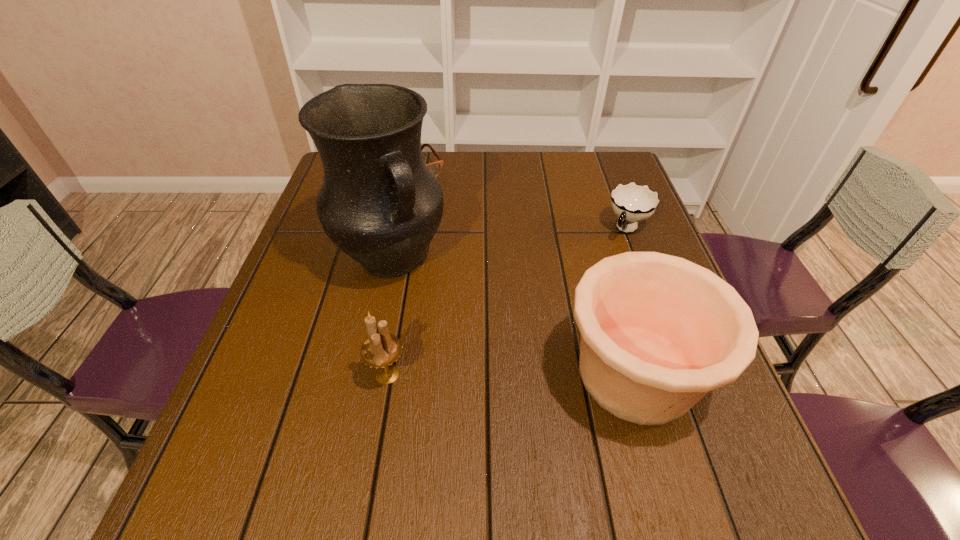
In the image, there is a desktop. What are the coordinates of `vacant space at the far right corner` in the screenshot? It's located at (582, 175).

Identify the location of vacant region between the cup and the shortest object. (519, 199).

At what (x,y) coordinates should I click in order to perform the action: click on vacant point located between the pottery and the pitcher. Please return your answer as a coordinate pair (x, y). Image resolution: width=960 pixels, height=540 pixels. Looking at the image, I should click on pyautogui.click(x=514, y=315).

You are a GUI agent. You are given a task and a screenshot of the screen. Output one action in this format:
    pyautogui.click(x=<x>, y=<y>)
    Task: Click on the vacant space that's between the shortest object and the pottery
    This screenshot has height=540, width=960.
    Given the screenshot: What is the action you would take?
    pyautogui.click(x=523, y=271)

Where is `vacant space that's between the pitcher and the cup`? This screenshot has height=540, width=960. vacant space that's between the pitcher and the cup is located at coordinates (510, 243).

Image resolution: width=960 pixels, height=540 pixels. In order to click on free area in between the pottery and the candle holder in this screenshot , I will do `click(512, 374)`.

Choose which object is the fourth nearest neighbor to the tallest object. Please provide its 2D coordinates. Your answer should be formatted as a tuple, i.e. [(x, y)], where the tuple contains the x and y coordinates of a point satisfying the conditions above.

[(632, 203)]

Identify the location of object that is the nearest to the candle holder. The width and height of the screenshot is (960, 540). (379, 203).

Locate an element on the screen. This screenshot has width=960, height=540. free space that satisfies the following two spatial constraints: 1. on the front side of the shortest object; 2. on the right side of the candle holder is located at coordinates (368, 374).

Where is `free region that satisfies the following two spatial constraints: 1. on the back side of the shortest object; 2. on the left side of the pitcher`? This screenshot has height=540, width=960. free region that satisfies the following two spatial constraints: 1. on the back side of the shortest object; 2. on the left side of the pitcher is located at coordinates (410, 168).